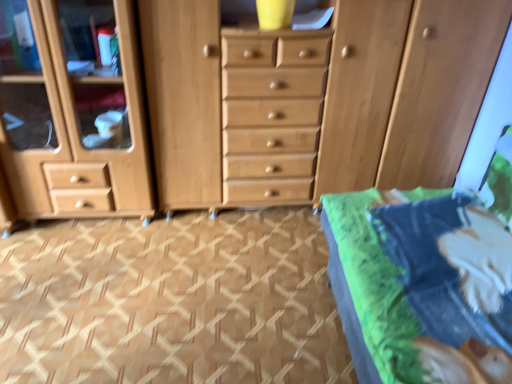
Question: Considering the positions of point (65, 231) and point (246, 117), is point (65, 231) closer or farther from the camera than point (246, 117)?

Choices:
 (A) farther
 (B) closer

Answer: (A)

Question: Is brown textured carpet at center spatially inside light brown wood chest of drawers at center, or outside of it?

Choices:
 (A) outside
 (B) inside

Answer: (A)

Question: Estimate the real-world distances between objects in this image. Which object is closer to the light brown wood chest of drawers at center?

Choices:
 (A) brown textured carpet at center
 (B) green fabric bed at lower right

Answer: (A)

Question: Estimate the real-world distances between objects in this image. Which object is closer to the brown textured carpet at center?

Choices:
 (A) light brown wood chest of drawers at center
 (B) green fabric bed at lower right

Answer: (A)